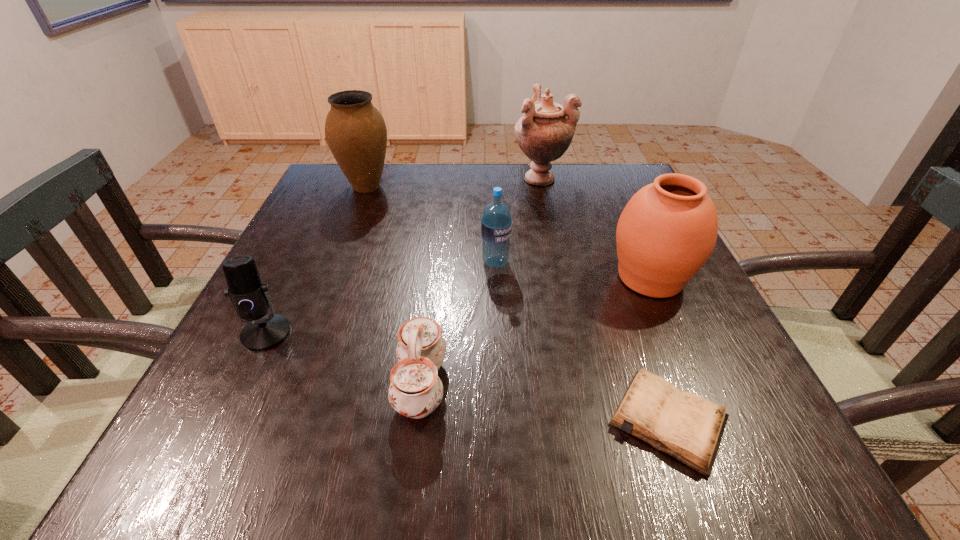
Where is `vacant region located 0.200m on the left of the rightmost urn`? vacant region located 0.200m on the left of the rightmost urn is located at coordinates (511, 278).

Where is `blank space located on the right of the fourth object from left to right`? This screenshot has height=540, width=960. blank space located on the right of the fourth object from left to right is located at coordinates (617, 262).

In order to click on vacant space situated on the stand of the microphone in this screenshot , I will do `click(246, 375)`.

Where is `vacant space positioned 0.370m by the handle of the third object from left to right`? The height and width of the screenshot is (540, 960). vacant space positioned 0.370m by the handle of the third object from left to right is located at coordinates (677, 384).

In order to click on blank space located 0.070m on the back of the diary in this screenshot , I will do `click(640, 341)`.

I want to click on chinaware positioned at the near edge, so click(415, 391).

You are a GUI agent. You are given a task and a screenshot of the screen. Output one action in this format:
    pyautogui.click(x=<x>, y=<y>)
    Task: Click on the diary situated at the near edge
    
    Given the screenshot: What is the action you would take?
    [688, 427]

I want to click on urn that is at the left edge, so click(356, 133).

What are the coordinates of `microphone present at the left edge` in the screenshot? It's located at (250, 297).

The width and height of the screenshot is (960, 540). Identify the location of urn present at the right edge. (667, 231).